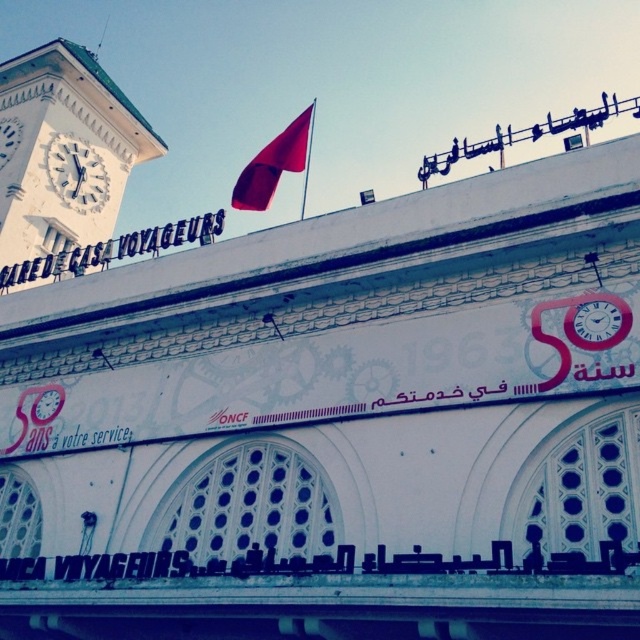
Question: Is white painted stone clock tower at left further to camera compared to matte red flag at upper center?

Choices:
 (A) no
 (B) yes

Answer: (B)

Question: Which object is positioned farthest from the matte red flag at upper center?

Choices:
 (A) white painted stone clock tower at left
 (B) white clock face at upper left

Answer: (B)

Question: Estimate the real-world distances between objects in this image. Which object is farther from the white painted stone clock tower at left?

Choices:
 (A) matte red flag at upper center
 (B) white clock face at upper left
 (C) white matte clock at upper left

Answer: (A)

Question: Is matte red flag at upper center closer to camera compared to white clock face at upper left?

Choices:
 (A) yes
 (B) no

Answer: (A)

Question: Does white matte clock at upper left appear over white clock face at upper left?

Choices:
 (A) yes
 (B) no

Answer: (B)

Question: Which object is closer to the camera taking this photo?

Choices:
 (A) white clock face at upper left
 (B) white matte clock at upper left
 (C) matte red flag at upper center

Answer: (C)